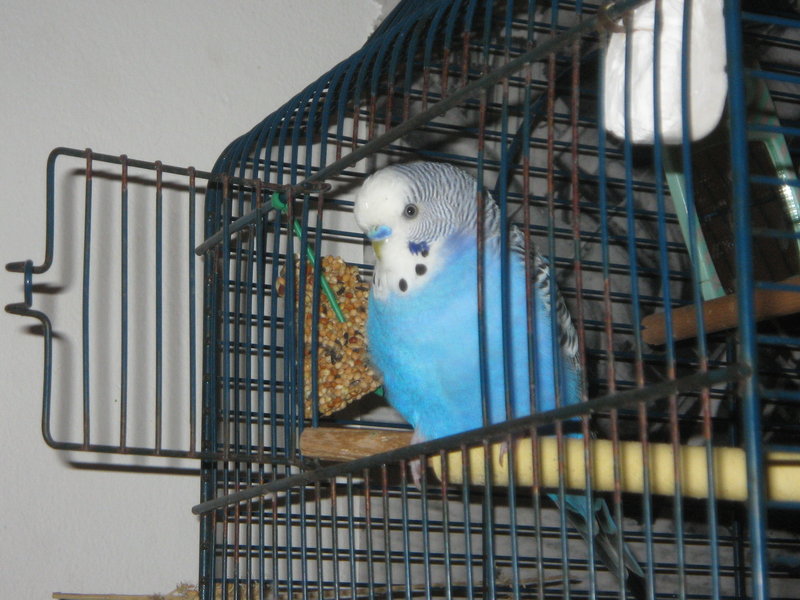
At what (x,y) coordinates should I click in order to perform the action: click on mirror. Please return your answer as a coordinate pair (x, y). Looking at the image, I should click on (676, 110).